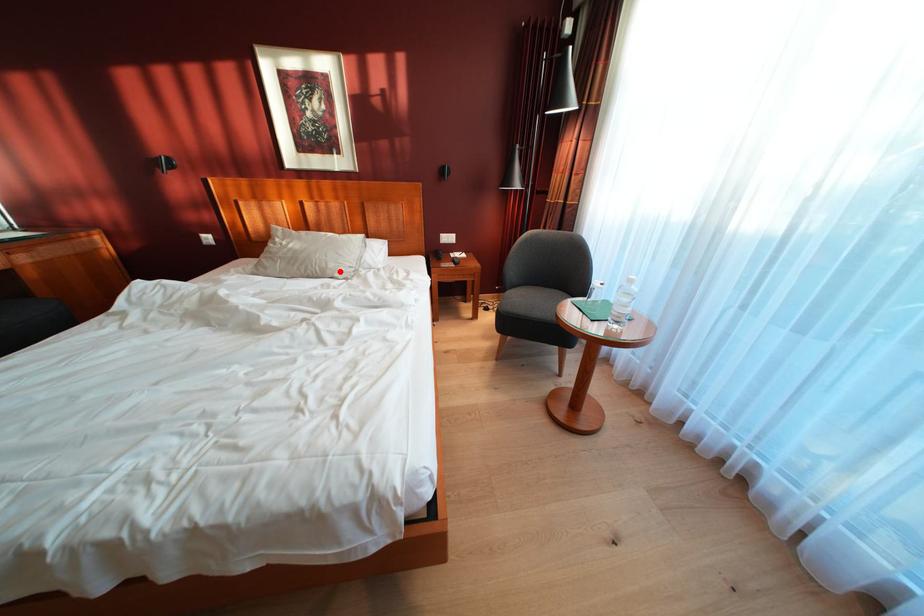
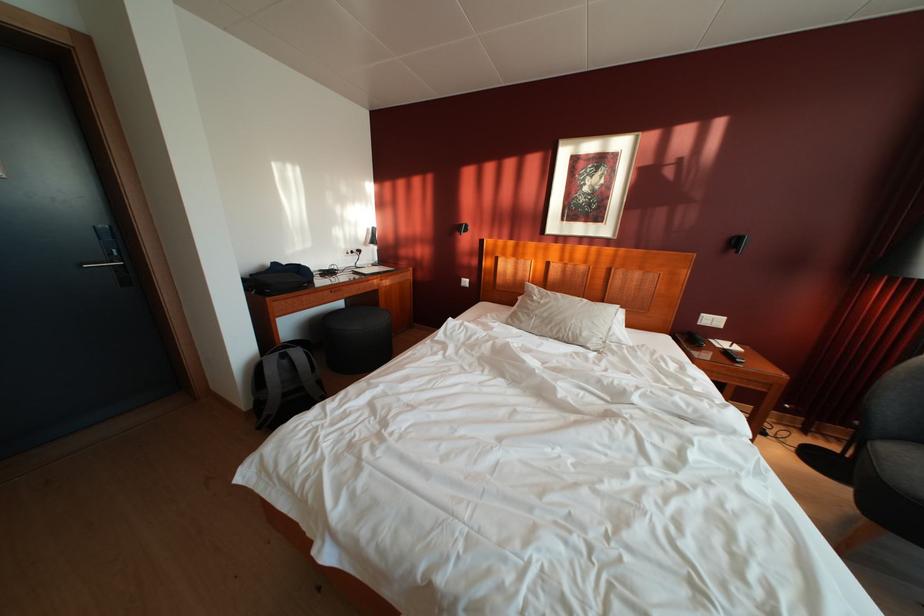
Where in the second image is the point corresponding to the highlighted location from the first image?

(593, 339)